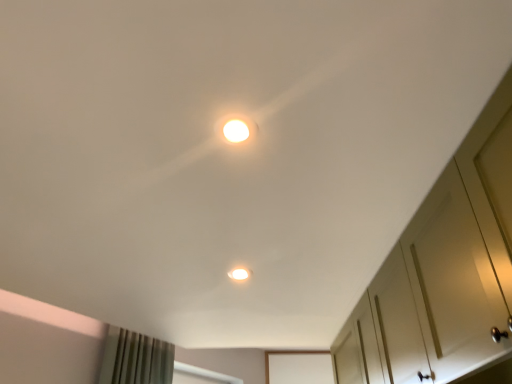
Question: From a real-world perspective, is white glossy light fixture at upper center, the second dot from the back, positioned above or below matte white light at center, marked as the first dot in a back-to-front arrangement?

Choices:
 (A) above
 (B) below

Answer: (B)

Question: In terms of size, does white glossy light fixture at upper center, positioned as the 2th dot in bottom-to-top order, appear bigger or smaller than matte white light at center, the second dot viewed from the top?

Choices:
 (A) big
 (B) small

Answer: (B)

Question: Which is nearer to the matte white light at center, marked as the first dot in a back-to-front arrangement?

Choices:
 (A) white matte cabinet at right
 (B) white glossy light fixture at upper center, the first dot when ordered from top to bottom

Answer: (A)

Question: Which object is the closest to the white matte cabinet at right?

Choices:
 (A) white glossy light fixture at upper center, the first dot when ordered from top to bottom
 (B) matte white light at center, the 2th dot in the front-to-back sequence

Answer: (B)